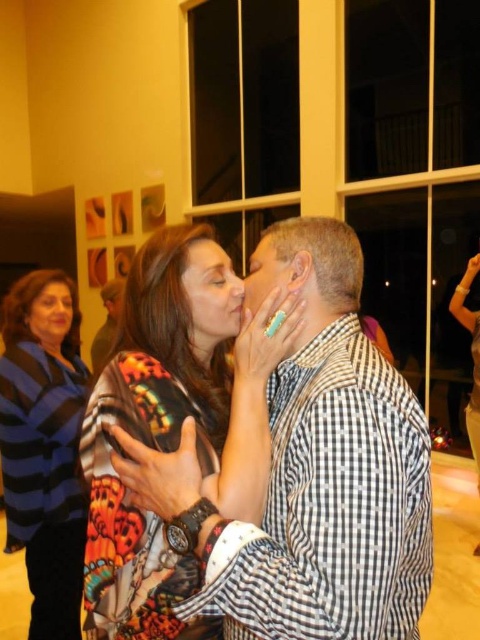
Can you confirm if blue striped sweater at left is wider than matte black face at upper left?

Yes, blue striped sweater at left is wider than matte black face at upper left.

Is point (83, 490) positioned after point (58, 320)?

That is False.

Who is more distant from viewer, (78, 337) or (36, 323)?

Positioned behind is point (78, 337).

In order to click on blue striped sweater at left in this screenshot , I will do `click(45, 445)`.

What do you see at coordinates (211, 292) in the screenshot? The image size is (480, 640). I see `matte skin at center` at bounding box center [211, 292].

Is point (204, 307) in front of point (47, 339)?

Yes, it is.

This screenshot has width=480, height=640. Find the location of `matte skin at center`. matte skin at center is located at coordinates (211, 292).

Can you confirm if printed silk blouse at center is positioned above matte skin face at center?

Actually, printed silk blouse at center is below matte skin face at center.

Between printed silk blouse at center and matte skin face at center, which one has less height?

matte skin face at center is shorter.

Which is behind, point (158, 330) or point (250, 259)?

Point (250, 259)

The height and width of the screenshot is (640, 480). I want to click on printed silk blouse at center, so click(173, 422).